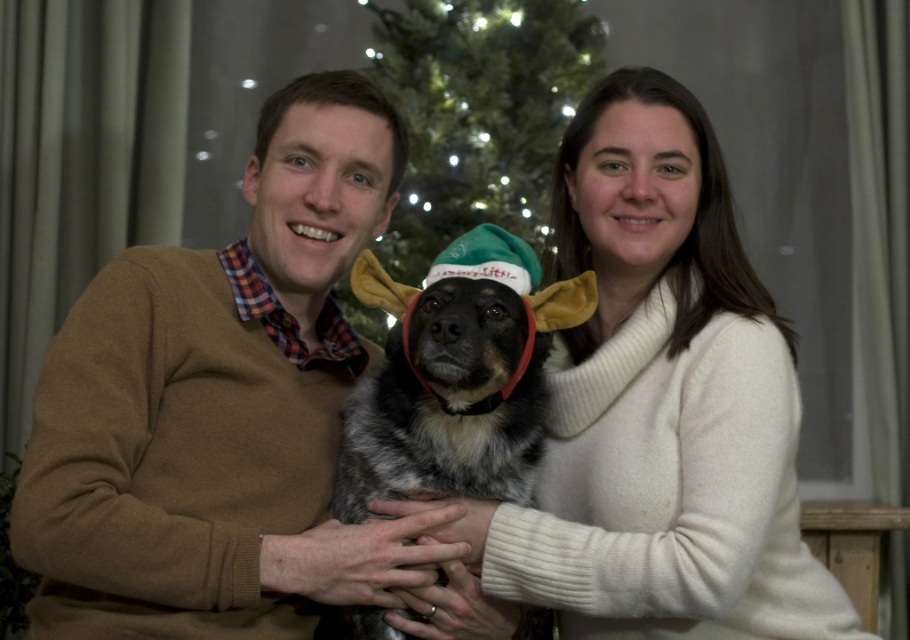
Question: Does speckled fur dog at center have a lesser width compared to green textured christmas tree at center?

Choices:
 (A) no
 (B) yes

Answer: (B)

Question: Which object appears closest to the camera in this image?

Choices:
 (A) white woolen sweater at center
 (B) brown sweater at center
 (C) speckled fur dog at center

Answer: (B)

Question: Which object is positioned closest to the green textured christmas tree at center?

Choices:
 (A) white woolen sweater at center
 (B) brown sweater at center
 (C) speckled fur dog at center

Answer: (A)

Question: Is white woolen sweater at center bigger than speckled fur dog at center?

Choices:
 (A) yes
 (B) no

Answer: (A)

Question: Does brown sweater at center appear over speckled fur dog at center?

Choices:
 (A) yes
 (B) no

Answer: (A)

Question: Considering the real-world distances, which object is closest to the green textured christmas tree at center?

Choices:
 (A) speckled fur dog at center
 (B) brown sweater at center
 (C) white woolen sweater at center

Answer: (C)